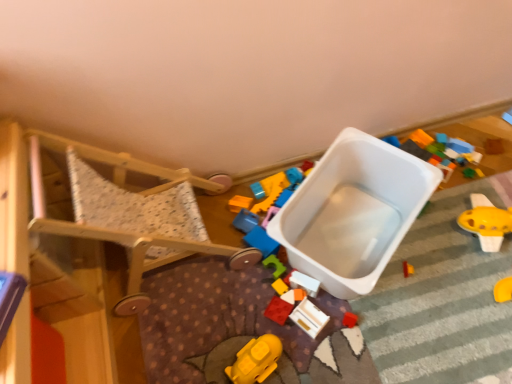
The image size is (512, 384). Identify the location of vacant location behind white plastic toy at center, the 3th toy positioned from the right. (x=311, y=242).